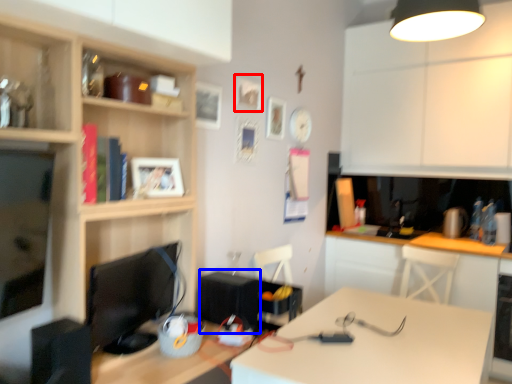
Question: Which object is further to the camera taking this photo, picture frame (highlighted by a red box) or appliance (highlighted by a blue box)?

Choices:
 (A) picture frame
 (B) appliance

Answer: (A)